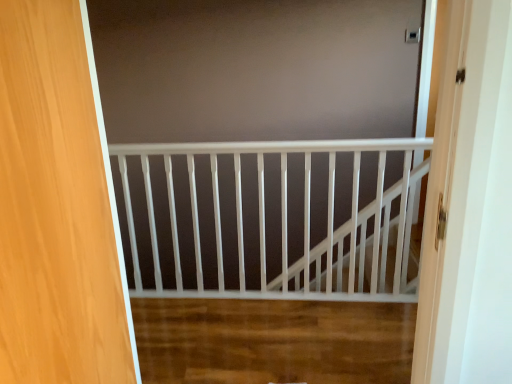
The height and width of the screenshot is (384, 512). In order to click on white glossy rail at center in this screenshot , I will do `click(287, 221)`.

What do you see at coordinates (287, 221) in the screenshot? I see `white glossy rail at center` at bounding box center [287, 221].

What is the approximate width of white glossy rail at center?

2.69 inches.

The image size is (512, 384). Find the location of `white glossy rail at center`. white glossy rail at center is located at coordinates (287, 221).